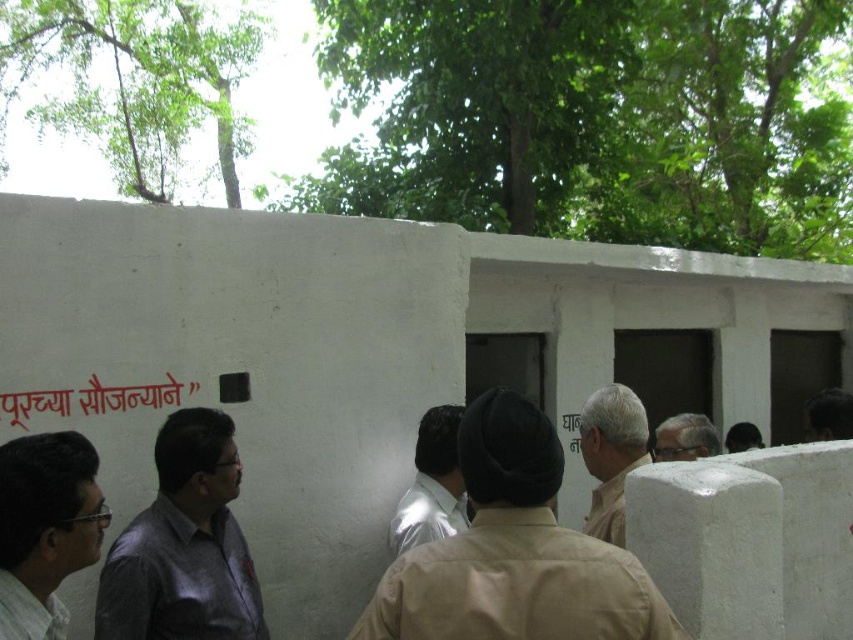
Does shiny white shirt at center appear over light beige fabric turban at center?

No.

Does shiny white shirt at center have a greater height compared to light beige fabric turban at center?

Correct, shiny white shirt at center is much taller as light beige fabric turban at center.

Who is more forward, [451,509] or [670,428]?

Point [451,509]

Where is `shiny white shirt at center`? shiny white shirt at center is located at coordinates (431, 484).

Between red painted text at lower left and light beige fabric turban at center, which one is positioned higher?

red painted text at lower left

The image size is (853, 640). I want to click on red painted text at lower left, so click(91, 400).

Find the location of a particular element. red painted text at lower left is located at coordinates (91, 400).

Does dark brown hair at upper right appear on the right side of dark brown hair at center?

No, dark brown hair at upper right is not to the right of dark brown hair at center.

Which is behind, point (827, 413) or point (730, 451)?

The point (730, 451) is more distant.

At what (x,y) coordinates should I click in order to perform the action: click on dark brown hair at upper right. Please return your answer as a coordinate pair (x, y). The height and width of the screenshot is (640, 853). Looking at the image, I should click on (828, 416).